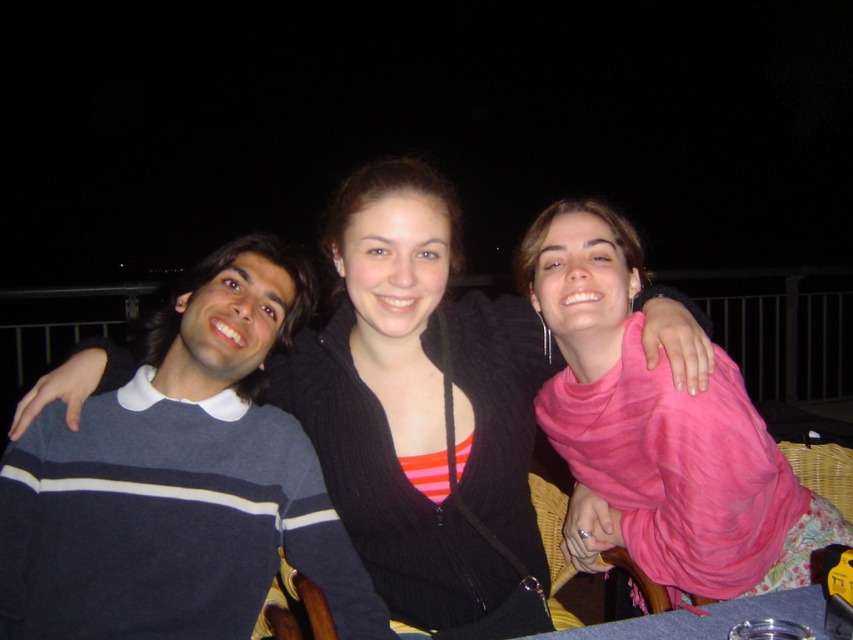
In the scene shown: You are standing in front of the image and want to locate the dark blue striped sweater at left. Where exactly is it positioned on the image?

The dark blue striped sweater at left is located at point coordinates of 0.752 on the x axis and 0.211 on the y axis.

You are a photographer trying to capture a group photo of the dark blue striped sweater at left and the pink fabric scarf at upper right. Which object should you focus on first if you want to ensure both are in the frame?

The dark blue striped sweater at left is to the left of the pink fabric scarf at upper right, so you should focus on the dark blue striped sweater at left first to ensure both are in the frame.